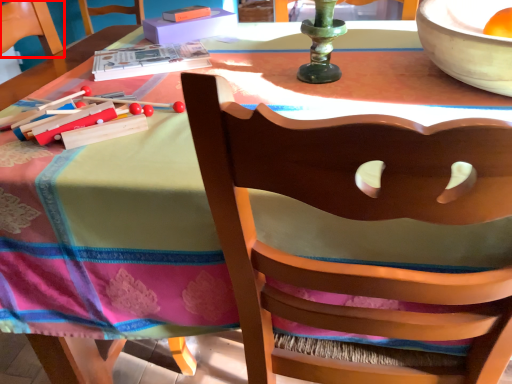
Question: From the image's perspective, where is armchair (annotated by the red box) located relative to chair?

Choices:
 (A) above
 (B) below

Answer: (A)